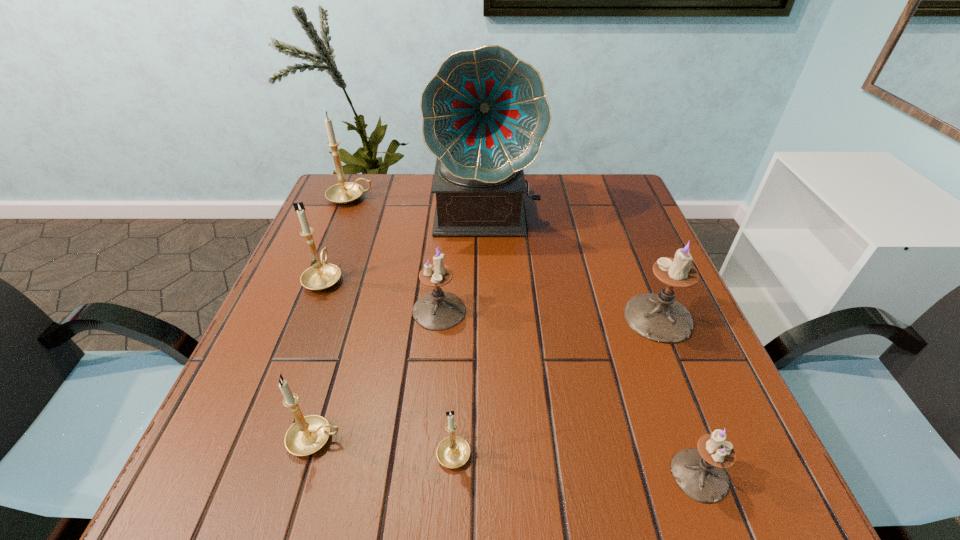
I want to click on free location at the near left corner of the desktop, so click(184, 485).

Locate an element on the screen. free space at the far right corner of the desktop is located at coordinates (631, 195).

The image size is (960, 540). Identify the location of vacant area that lies between the second smallest gold candle holder and the third nearest gold candle holder. (320, 359).

At what (x,y) coordinates should I click in order to perform the action: click on vacant area that lies between the third smallest gold candle holder and the nearest purple candle holder. Please return your answer as a coordinate pair (x, y). Looking at the image, I should click on (512, 376).

Find the location of `empty space between the tallest candle holder and the tallest object`. empty space between the tallest candle holder and the tallest object is located at coordinates (419, 206).

Where is `empty space that is in between the rightmost gold candle holder and the biggest purple candle holder`? empty space that is in between the rightmost gold candle holder and the biggest purple candle holder is located at coordinates (556, 384).

You are a GUI agent. You are given a task and a screenshot of the screen. Output one action in this format:
    pyautogui.click(x=<x>, y=<y>)
    Task: Click on the free point between the second biggest purple candle holder and the second tallest object
    This screenshot has width=960, height=540.
    Given the screenshot: What is the action you would take?
    pyautogui.click(x=395, y=254)

Where is `free space between the second farthest gold candle holder and the rightmost gold candle holder`? free space between the second farthest gold candle holder and the rightmost gold candle holder is located at coordinates (389, 364).

Where is `free space between the record player and the nearest purple candle holder`? The width and height of the screenshot is (960, 540). free space between the record player and the nearest purple candle holder is located at coordinates (592, 344).

You are a GUI agent. You are given a task and a screenshot of the screen. Output one action in this format:
    pyautogui.click(x=<x>, y=<y>)
    Task: Click on the vacant space that is in between the smallest gold candle holder and the second smallest purple candle holder
    The height and width of the screenshot is (540, 960).
    Given the screenshot: What is the action you would take?
    pyautogui.click(x=446, y=381)